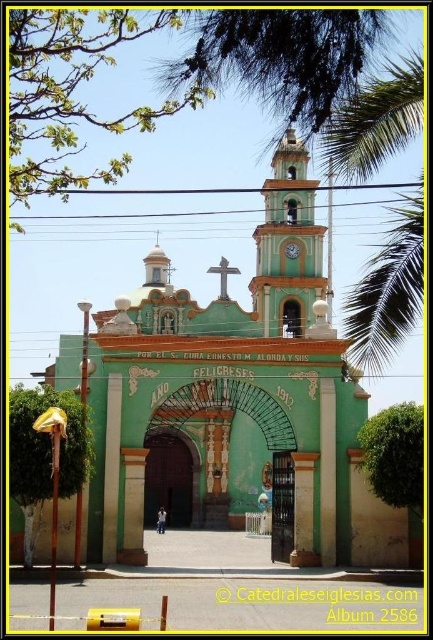
From the picture: You are standing in front of the church and see two points marked on the facade. The first point is at coordinates point (390, 310) and the second is at point (290, 244). Which point is closer to you?

Point (390, 310) is in front of point (290, 244), so it is closer to you.

You are standing 50 meters away from the church facade. You want to take a photo of the green leafy palm tree at upper right without including the church. Is the palm tree far enough to frame it separately?

The green leafy palm tree at upper right is 70.50 meters away from the camera. Since you are standing 50 meters away from the church facade, the palm tree is 20.50 meters behind the church. Therefore, it should be possible to frame the palm tree separately by adjusting the camera angle or moving further back to exclude the church in the shot.